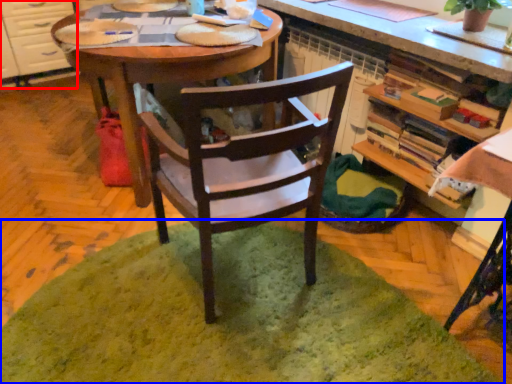
Question: Which of the following is the closest to the observer, cabinetry (highlighted by a red box) or mat (highlighted by a blue box)?

Choices:
 (A) cabinetry
 (B) mat

Answer: (B)